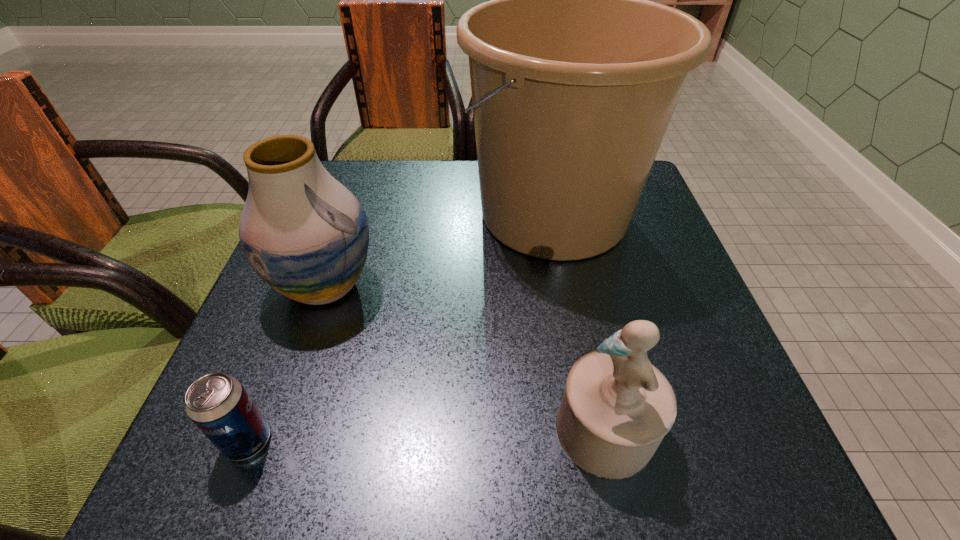
This screenshot has width=960, height=540. What are the coordinates of `vacant area between the tallest object and the vase` in the screenshot? It's located at (440, 250).

Locate an element on the screen. empty space that is in between the figurine and the shortest object is located at coordinates (426, 435).

This screenshot has height=540, width=960. I want to click on vacant region between the beer can and the figurine, so click(x=426, y=435).

The width and height of the screenshot is (960, 540). Identify the location of empty space between the shortest object and the vase. (286, 363).

Locate an element on the screen. Image resolution: width=960 pixels, height=540 pixels. vacant space that is in between the bucket and the vase is located at coordinates (440, 250).

Select which object appears as the closest to the vase. Please provide its 2D coordinates. Your answer should be formatted as a tuple, i.e. [(x, y)], where the tuple contains the x and y coordinates of a point satisfying the conditions above.

[(575, 75)]

Identify the location of object identified as the third closest to the tallest object. The height and width of the screenshot is (540, 960). (218, 404).